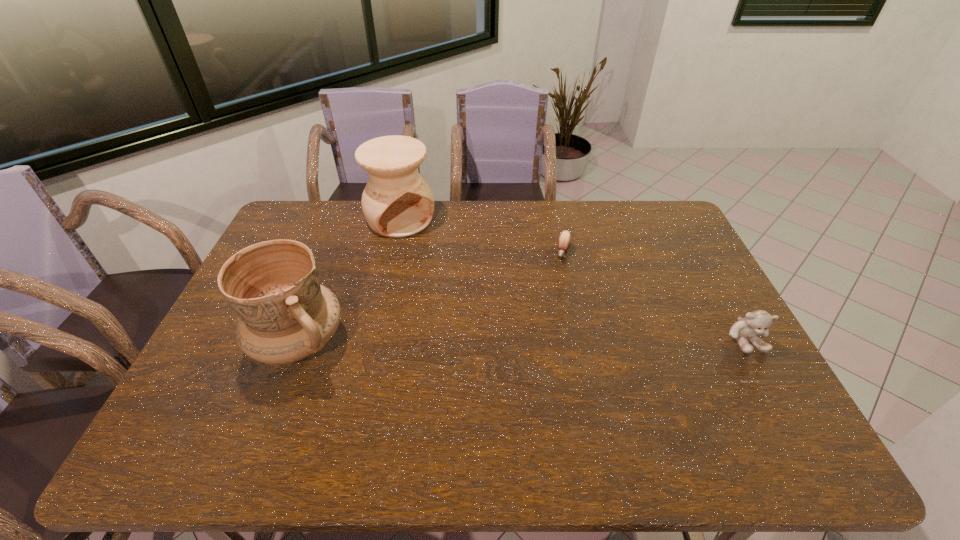
Find the location of a particular element. the nearer pottery is located at coordinates (285, 315).

In order to click on the rightmost object in this screenshot , I will do `click(757, 322)`.

You are a GUI agent. You are given a task and a screenshot of the screen. Output one action in this format:
    pyautogui.click(x=<x>, y=<y>)
    Task: Click on the teddy bear
    Image resolution: width=960 pixels, height=540 pixels.
    Given the screenshot: What is the action you would take?
    pyautogui.click(x=757, y=322)

Identify the location of the farthest object. This screenshot has height=540, width=960. (397, 202).

This screenshot has width=960, height=540. I want to click on the third object from left to right, so click(564, 240).

The image size is (960, 540). I want to click on escargot, so click(x=564, y=240).

Identify the location of vacant position located on the right of the nearer pottery. (433, 342).

Locate an element on the screen. The width and height of the screenshot is (960, 540). vacant position located on the face of the teddy bear is located at coordinates (781, 404).

Where is `vacant space located 0.140m at the open side of the farther pottery`? vacant space located 0.140m at the open side of the farther pottery is located at coordinates (436, 258).

At what (x,y) coordinates should I click in order to perform the action: click on free point located 0.300m at the open side of the farther pottery. Please return your answer as a coordinate pair (x, y). Image resolution: width=960 pixels, height=540 pixels. Looking at the image, I should click on (460, 286).